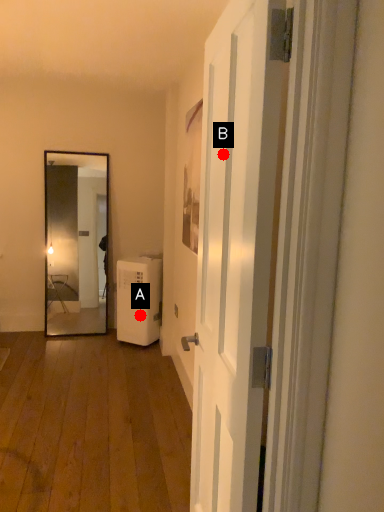
Question: Two points are circled on the image, labeled by A and B beside each circle. Among these points, which one is farthest from the camera?

Choices:
 (A) A is further
 (B) B is further

Answer: (A)